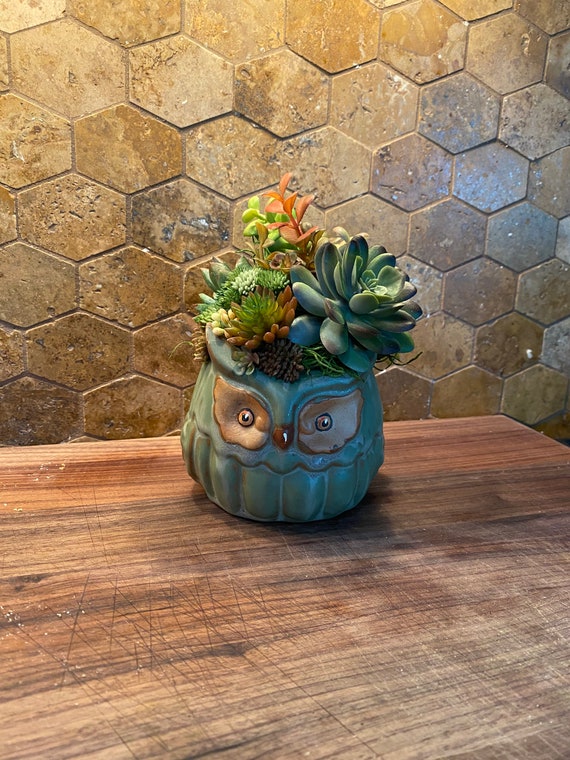
The width and height of the screenshot is (570, 760). I want to click on wall, so click(x=271, y=152).